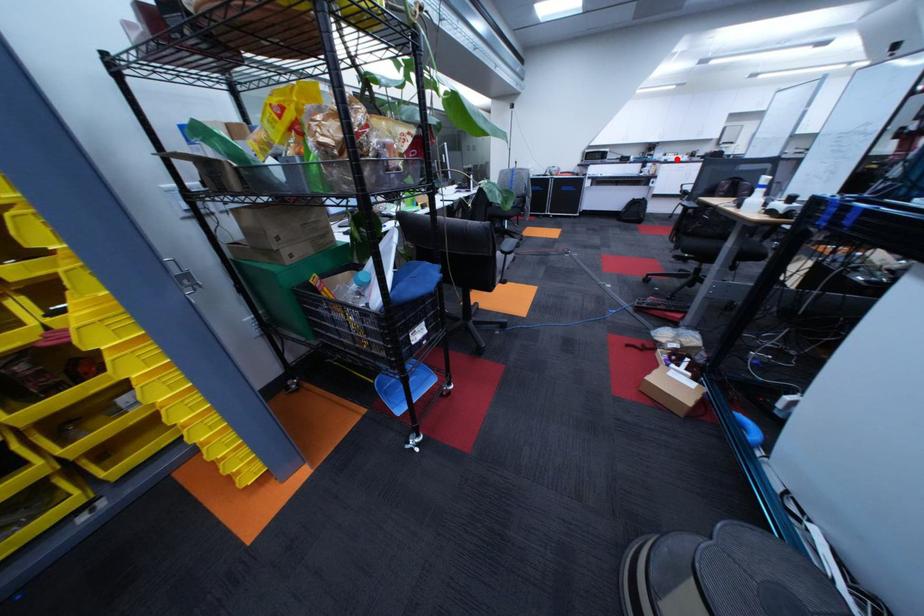
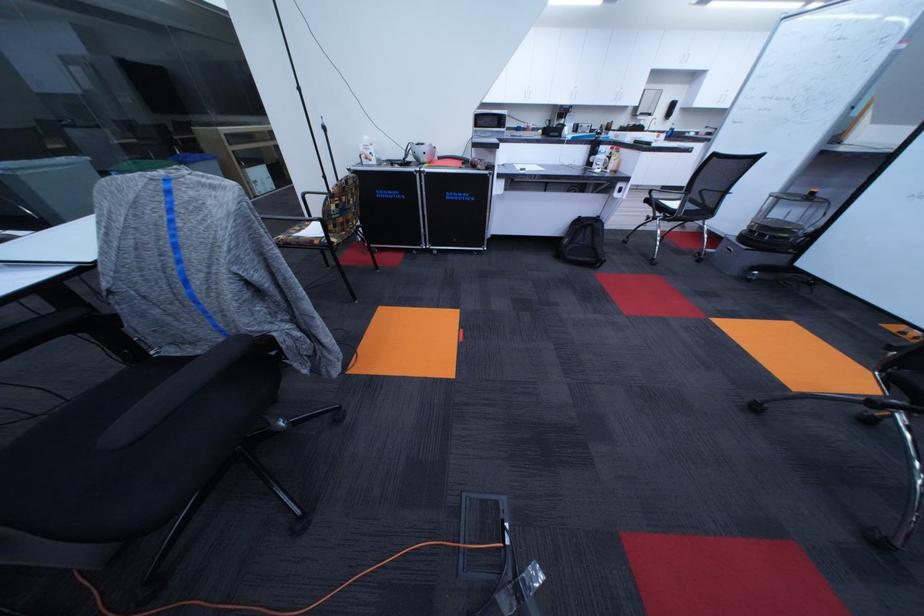
Locate, in the second image, the point that corresponds to the highlighted location in the first image.

(642, 138)